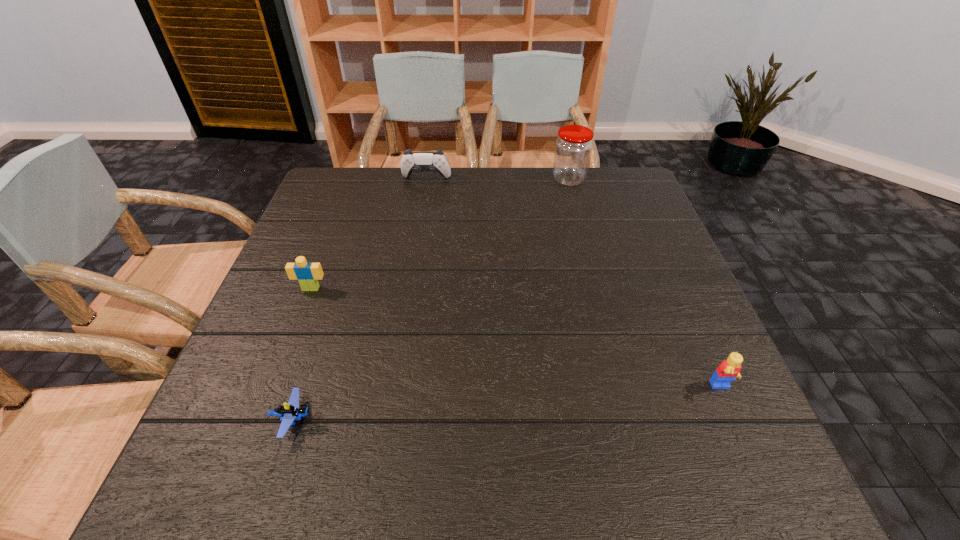
Identify the location of free space at the left edge of the desktop. This screenshot has height=540, width=960. coord(212,426).

In the image, there is a desktop. Identify the location of vacant space at the right edge. This screenshot has width=960, height=540. tap(687, 346).

The height and width of the screenshot is (540, 960). What are the coordinates of `free space at the far left corner` in the screenshot? It's located at (337, 183).

Locate an element on the screen. vacant position at the far right corner of the desktop is located at coordinates (630, 194).

You are a GUI agent. You are given a task and a screenshot of the screen. Output one action in this format:
    pyautogui.click(x=<x>, y=<y>)
    Task: Click on the free space that is in between the shortest object and the control
    The width and height of the screenshot is (960, 540).
    Given the screenshot: What is the action you would take?
    pyautogui.click(x=360, y=300)

Where is `unoccupied area between the shortest Lego and the farthest Lego`? The image size is (960, 540). unoccupied area between the shortest Lego and the farthest Lego is located at coordinates (302, 354).

Identify the location of vacant region between the shortest Lego and the rightmost object. This screenshot has height=540, width=960. (508, 404).

I want to click on free space that is in between the shortest object and the control, so click(360, 300).

Identify the location of empty space that is in between the control and the tallest object. (497, 179).

Find the location of `vacant area that lies between the rightmost Lego and the second object from right to left`. vacant area that lies between the rightmost Lego and the second object from right to left is located at coordinates (645, 284).